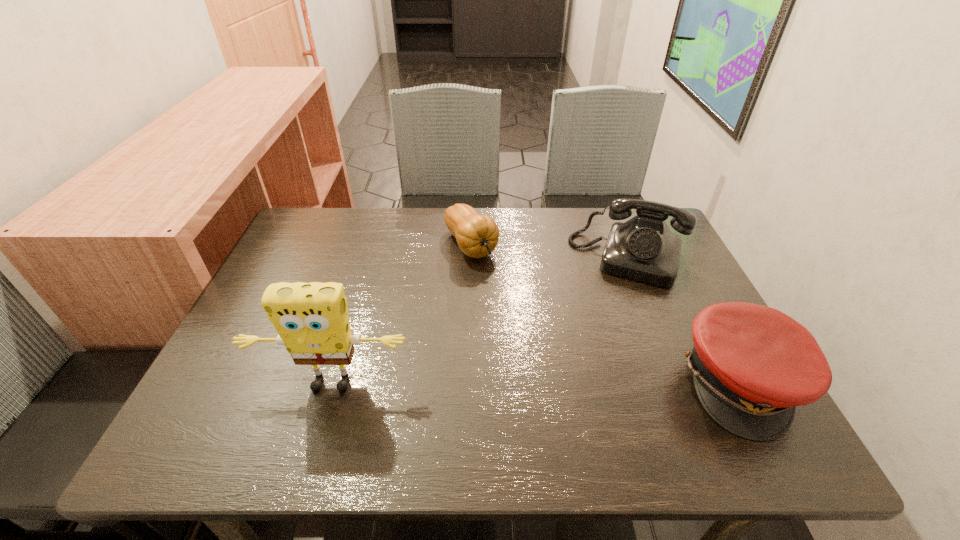
This screenshot has width=960, height=540. Identify the location of free region located 0.260m on the dial of the telephone. (596, 360).

This screenshot has width=960, height=540. In order to click on gourd situated at the far edge in this screenshot , I will do `click(477, 235)`.

Locate an element on the screen. This screenshot has width=960, height=540. telephone located at the far edge is located at coordinates tap(643, 249).

Locate an element on the screen. The width and height of the screenshot is (960, 540). sponge located at the near edge is located at coordinates (312, 320).

Identify the location of cap located at the near edge. Image resolution: width=960 pixels, height=540 pixels. (752, 365).

This screenshot has height=540, width=960. I want to click on object at the left edge, so click(x=312, y=320).

You are a GUI agent. You are given a task and a screenshot of the screen. Output one action in this format:
    pyautogui.click(x=<x>, y=<y>)
    Task: Click on the cap positioned at the right edge
    This screenshot has width=960, height=540.
    Given the screenshot: What is the action you would take?
    pyautogui.click(x=752, y=365)

Identify the location of telephone at the right edge. The image size is (960, 540). (643, 249).

This screenshot has height=540, width=960. Find the location of `object that is at the near left corner`. object that is at the near left corner is located at coordinates (312, 320).

Identify the location of object positioned at the far right corner. (643, 249).